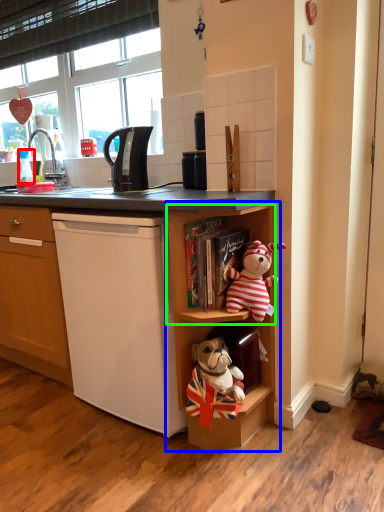
Question: Based on their relative distances, which object is farther from coffee cup (highlighted by a red box)? Choose from shelf (highlighted by a blue box) and shelf (highlighted by a green box).

Choices:
 (A) shelf
 (B) shelf

Answer: (A)